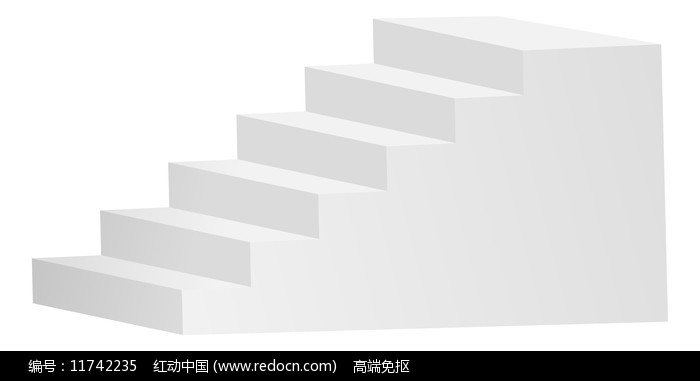
I want to click on stair, so click(87, 290), click(166, 242), click(241, 199), click(304, 152), click(374, 111), click(456, 51).